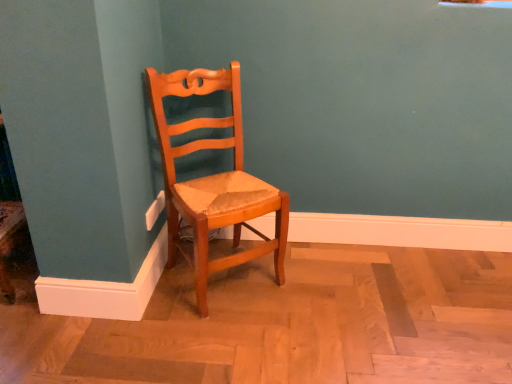
Locate an element on the screen. vacant region in front of wooden chair at center is located at coordinates (215, 334).